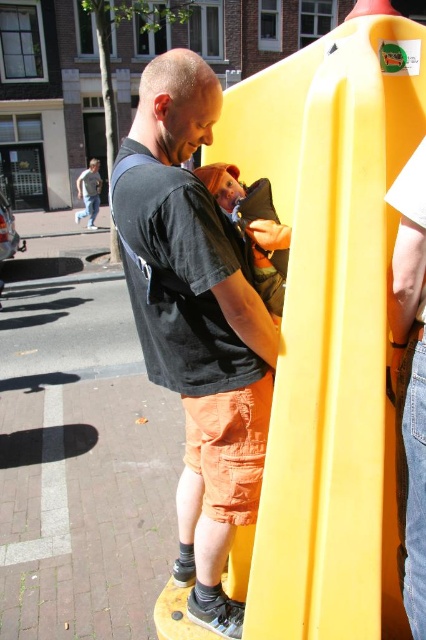
Question: Estimate the real-world distances between objects in this image. Which object is closer to the yellow plastic slide at center?

Choices:
 (A) matte black shirt at center
 (B) fluffy brown teddy bear at center

Answer: (B)

Question: Does yellow plastic slide at center appear on the left side of fluffy brown teddy bear at center?

Choices:
 (A) no
 (B) yes

Answer: (A)

Question: Does yellow plastic slide at center appear over matte black shirt at center?

Choices:
 (A) no
 (B) yes

Answer: (B)

Question: From the image, what is the correct spatial relationship of yellow plastic slide at center in relation to matte black shirt at center?

Choices:
 (A) above
 (B) below

Answer: (A)

Question: Which point is farther to the camera?

Choices:
 (A) fluffy brown teddy bear at center
 (B) matte black shirt at center

Answer: (A)

Question: Which of the following is the closest to the observer?

Choices:
 (A) matte black shirt at center
 (B) yellow plastic slide at center
 (C) fluffy brown teddy bear at center

Answer: (B)